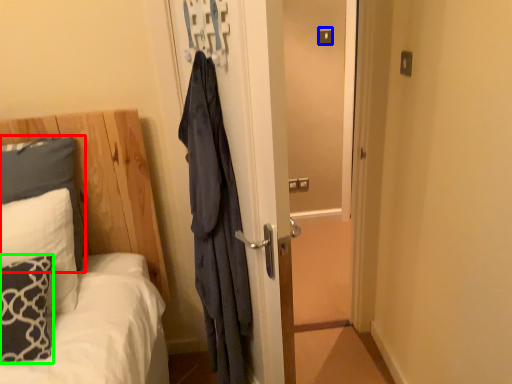
Question: Estimate the real-world distances between objects in this image. Which object is closer to pillow (highlighted by a red box), light switch (highlighted by a blue box) or pillow (highlighted by a green box)?

Choices:
 (A) light switch
 (B) pillow

Answer: (B)